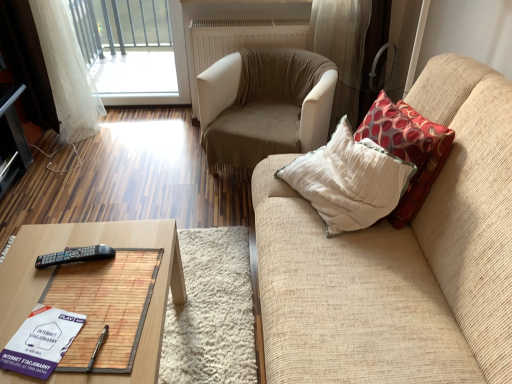
Locate an element on the screen. The width and height of the screenshot is (512, 384). spots to the right of black plastic remote at lower left is located at coordinates (126, 266).